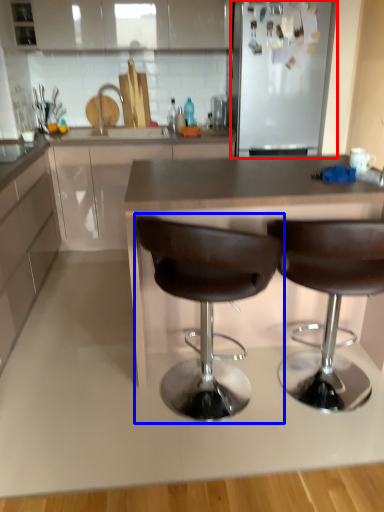
Question: Which object is further to the camera taking this photo, appliance (highlighted by a red box) or chair (highlighted by a blue box)?

Choices:
 (A) appliance
 (B) chair

Answer: (A)